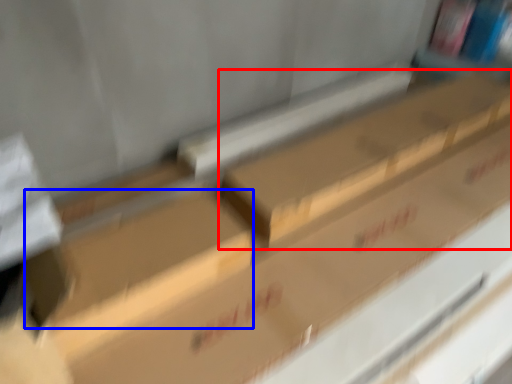
Question: Which object appears closest to the camera in this image, box (highlighted by a red box) or block (highlighted by a blue box)?

Choices:
 (A) box
 (B) block

Answer: (B)